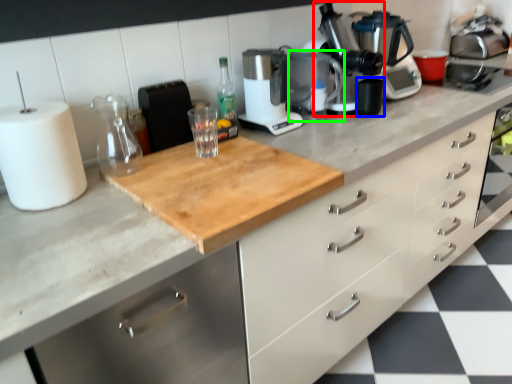
Question: Considering the real-world distances, which object is closest to coffee machine (highlighted by a red box)? appliance (highlighted by a blue box) or appliance (highlighted by a green box).

Choices:
 (A) appliance
 (B) appliance

Answer: (A)